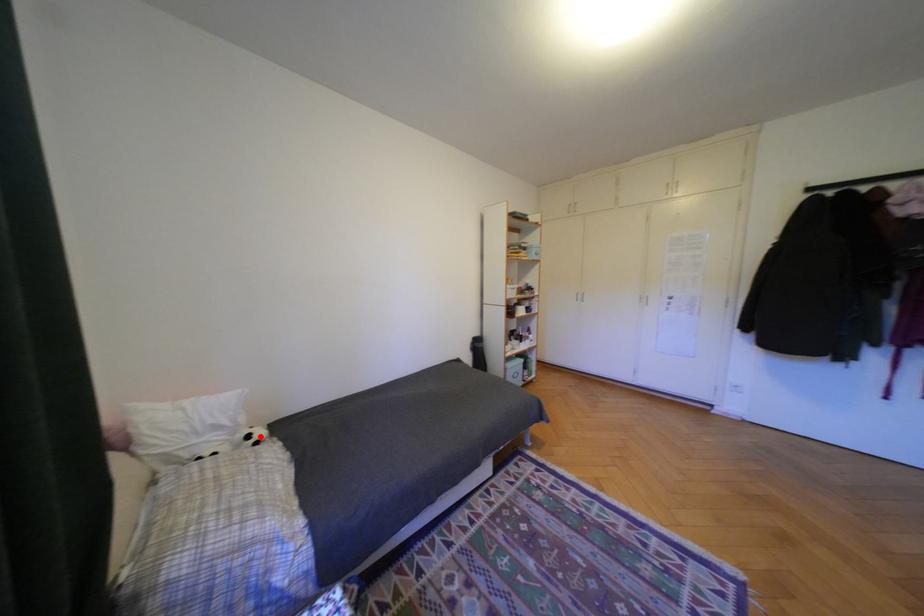
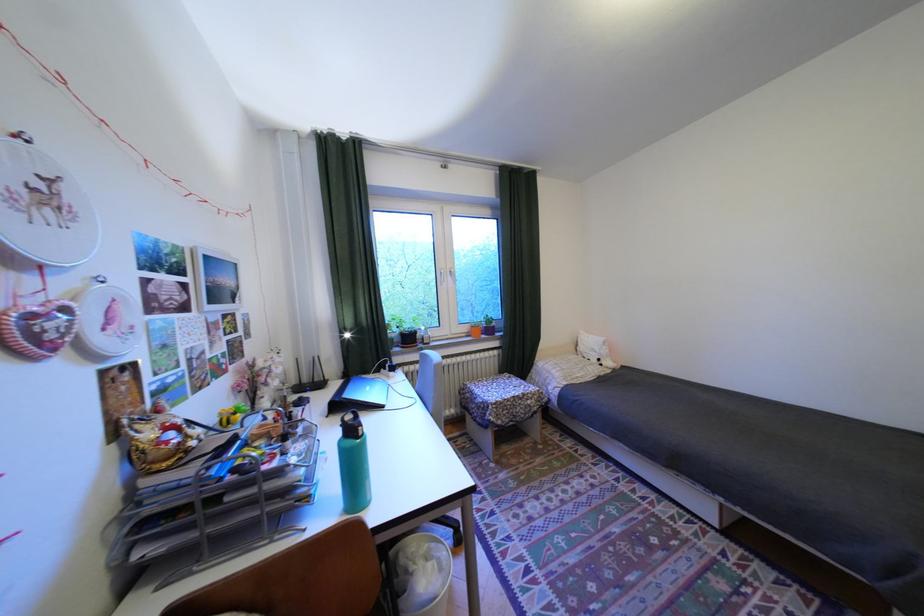
Question: I am providing you with two images of the same scene from different viewpoints. Given a red point in image1, look at the same physical point in image2. Is it:

Choices:
 (A) Closer to the viewpoint
 (B) Farther from the viewpoint

Answer: (B)